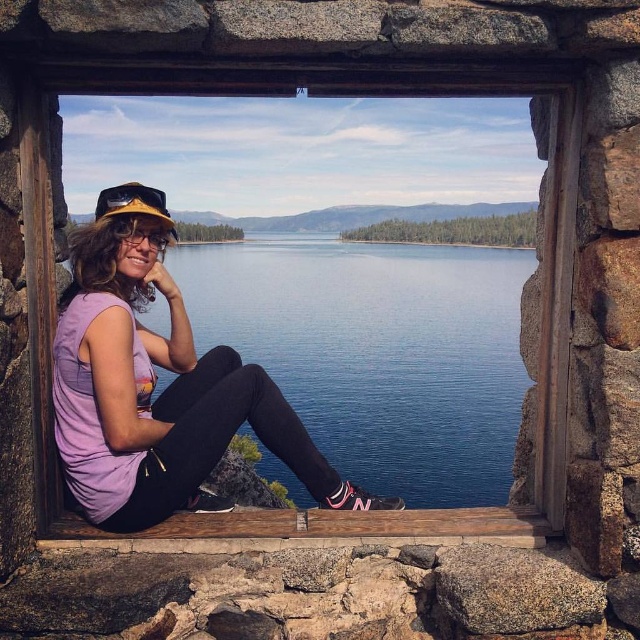
Question: Is purple fabric shirt at center smaller than matte yellow baseball cap at left?

Choices:
 (A) yes
 (B) no

Answer: (A)

Question: Is purple fabric shirt at center further to the viewer compared to matte yellow baseball cap at left?

Choices:
 (A) no
 (B) yes

Answer: (A)

Question: Which point appears closest to the camera in this image?

Choices:
 (A) (300, 428)
 (B) (410, 92)
 (C) (141, 204)
 (D) (145, 312)

Answer: (B)

Question: Is blue water at center positioned before wooden at center?

Choices:
 (A) no
 (B) yes

Answer: (A)

Question: Estimate the real-world distances between objects in this image. Which object is farther from the matte yellow baseball cap at left?

Choices:
 (A) blue water at center
 (B) wooden at center
 (C) purple fabric shirt at center

Answer: (A)

Question: Which object appears closest to the camera in this image?

Choices:
 (A) blue water at center
 (B) wooden at center
 (C) matte yellow baseball cap at left

Answer: (B)